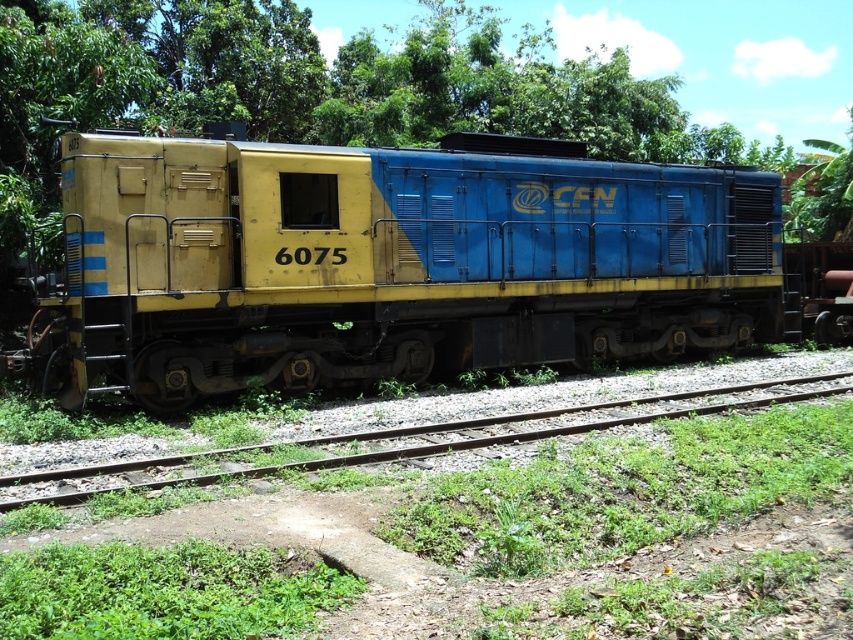
Question: Does yellow matte train at center have a greater width compared to gravel track at center?

Choices:
 (A) yes
 (B) no

Answer: (A)

Question: Which of the following is the closest to the observer?

Choices:
 (A) (374, 433)
 (B) (93, 156)

Answer: (A)

Question: Can you confirm if yellow matte train at center is positioned below gravel track at center?

Choices:
 (A) yes
 (B) no

Answer: (B)

Question: Which of the following is the farthest from the observer?

Choices:
 (A) yellow matte train at center
 (B) gravel track at center

Answer: (A)

Question: Can you confirm if yellow matte train at center is positioned to the right of gravel track at center?

Choices:
 (A) yes
 (B) no

Answer: (B)

Question: Among these points, which one is farthest from the camera?

Choices:
 (A) (169, 456)
 (B) (543, 298)

Answer: (B)